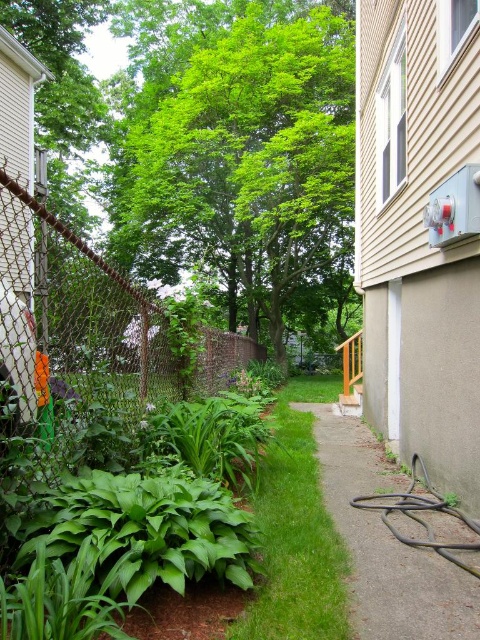
Is rusty chain-link fence at left smaller than green leafy grass at center?

Actually, rusty chain-link fence at left might be larger than green leafy grass at center.

The width and height of the screenshot is (480, 640). I want to click on rusty chain-link fence at left, so click(x=87, y=348).

Locate an element on the screen. Image resolution: width=480 pixels, height=640 pixels. green leafy tree at center is located at coordinates pyautogui.click(x=248, y=161).

Does point (344, 184) lie in front of point (446, 632)?

No.

This screenshot has width=480, height=640. I want to click on green leafy tree at center, so click(x=248, y=161).

Does black rubber hose at lower right appear on the left side of green leafy grass at center?

In fact, black rubber hose at lower right is to the right of green leafy grass at center.

Can you confirm if black rubber hose at lower right is taller than green leafy grass at center?

In fact, black rubber hose at lower right may be shorter than green leafy grass at center.

At what (x,y) coordinates should I click in order to perform the action: click on black rubber hose at lower right. Please return your answer as a coordinate pair (x, y). This screenshot has width=480, height=640. Looking at the image, I should click on (385, 544).